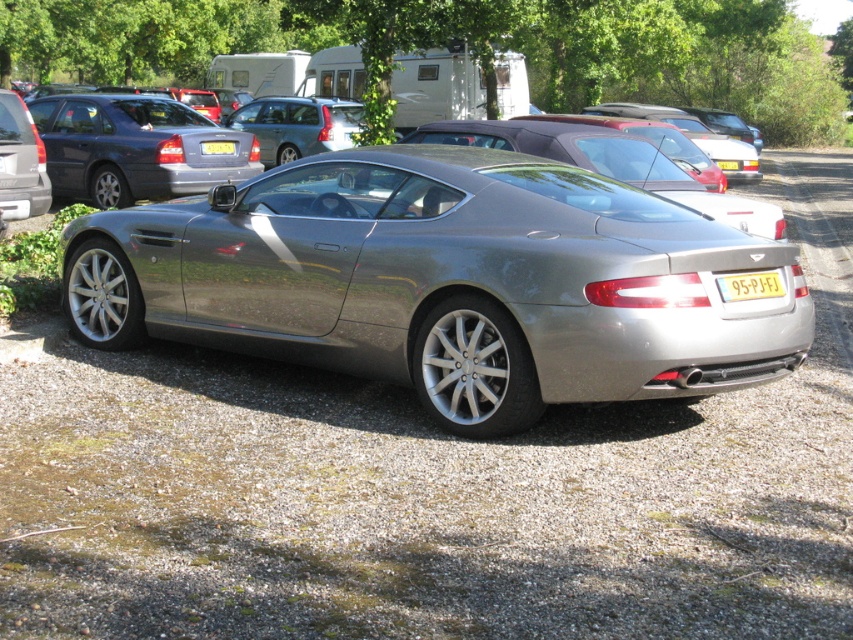
You are standing at the center of a parking lot surrounded by several vehicles. You see a point marked at coordinates (445, 282). Which vehicle is this point located on?

The point at (445, 282) is located on the satin silver car at center.

You are standing at the origin point of a coordinate system where the image is mapped. The origin is at the bottom left corner of the image. The x and y axes increase to the right and upwards respectively. You need to locate the satin silver car at center. What are its coordinates?

The satin silver car at center is located at coordinates approximately at point 0.442 on the x axis and 0.524 on the y axis.